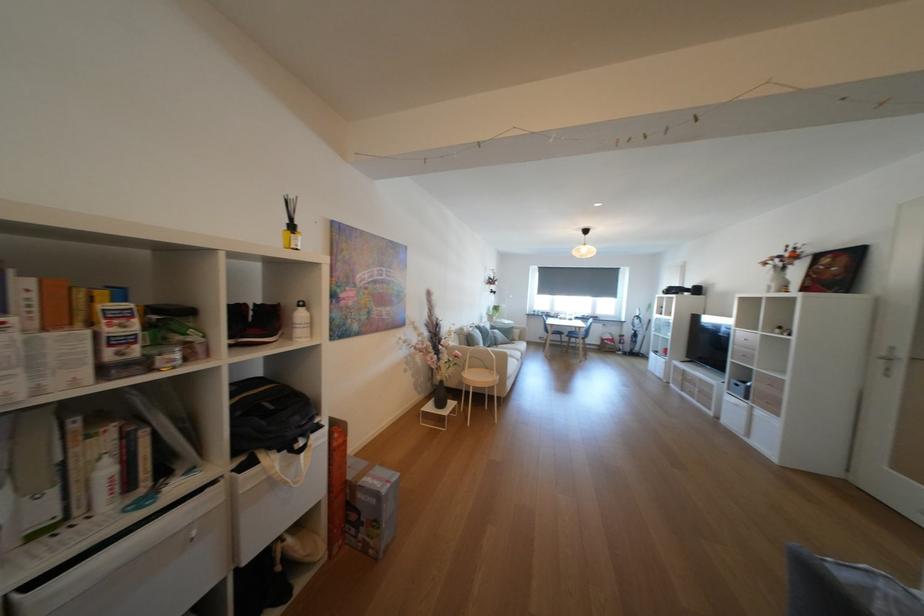
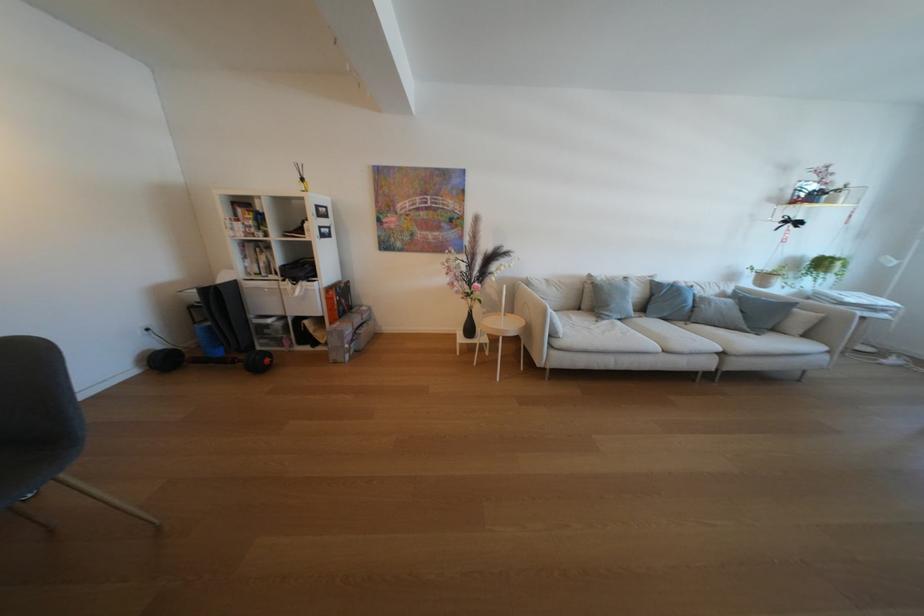
Locate, in the second image, the point that corresponds to point (502, 326) in the first image.

(739, 292)